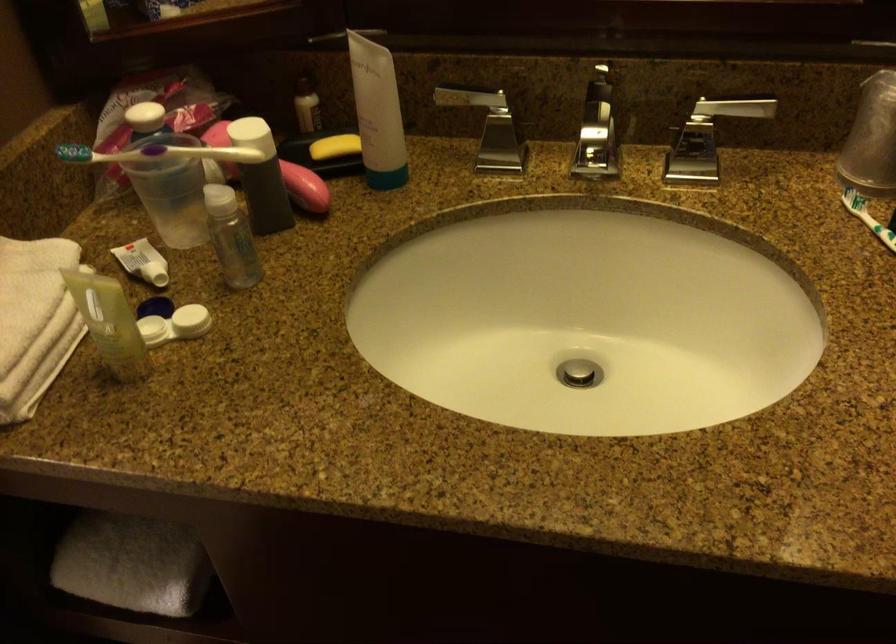
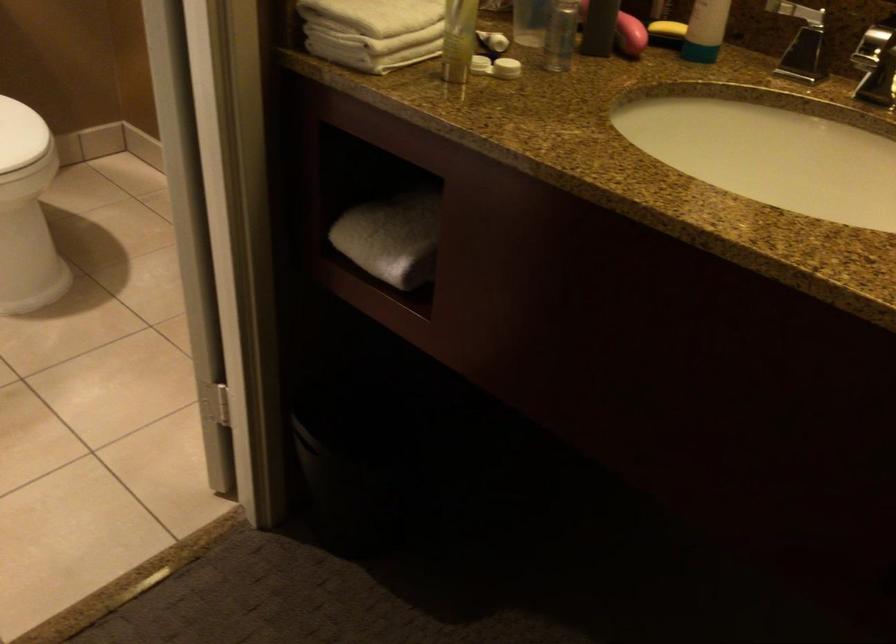
The point at (190, 323) is marked in the first image. Where is the corresponding point in the second image?

(506, 68)